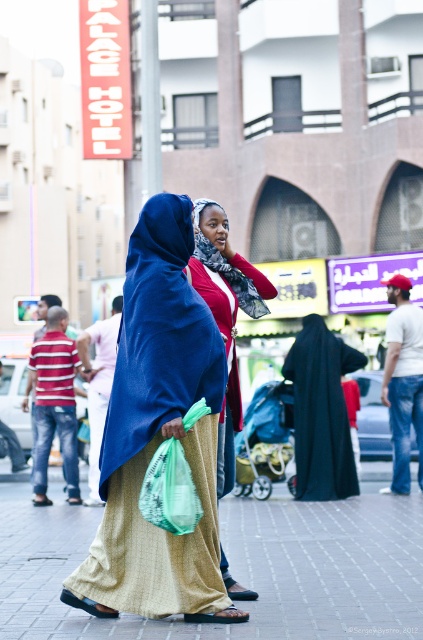
Question: Can you confirm if blue woven shawl at center is bigger than black matte robe at center?

Choices:
 (A) no
 (B) yes

Answer: (A)

Question: From the image, what is the correct spatial relationship of black matte robe at center in relation to matte red scarf at center?

Choices:
 (A) above
 (B) below

Answer: (B)

Question: Among these points, which one is nearest to the camera?

Choices:
 (A) (170, 381)
 (B) (69, 544)
 (C) (236, 275)
 (D) (326, 408)

Answer: (A)

Question: Estimate the real-world distances between objects in this image. Which object is farther from the black matte robe at center?

Choices:
 (A) blue woven shawl at center
 (B) beige woven fabric at lower center

Answer: (B)

Question: Among these points, which one is nearest to the camera?

Choices:
 (A) (320, 316)
 (B) (253, 304)

Answer: (B)

Question: Does beige woven fabric at lower center have a larger size compared to matte red scarf at center?

Choices:
 (A) no
 (B) yes

Answer: (A)